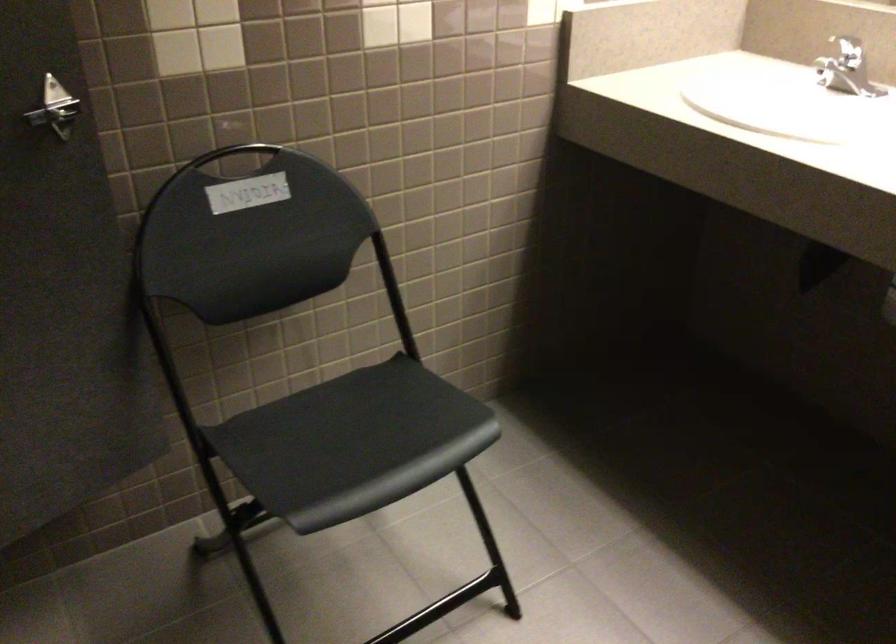
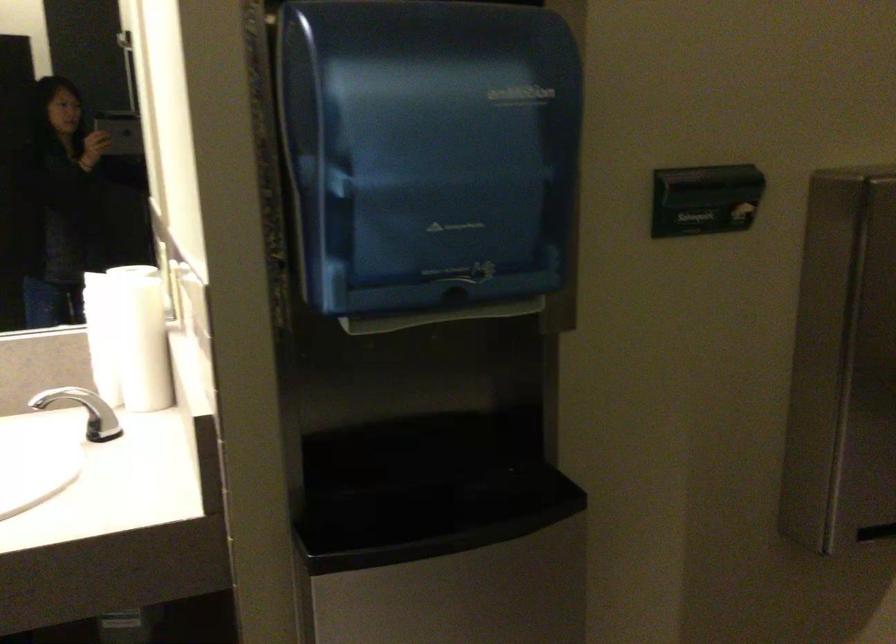
Question: Based on the continuous images, in which direction is the camera rotating? Reply with the corresponding letter.

Choices:
 (A) Left
 (B) Right
 (C) Up
 (D) Down

Answer: (B)